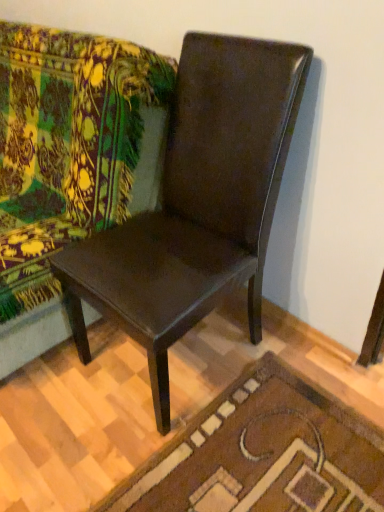
Where is `glossy brown chair at center`? This screenshot has width=384, height=512. glossy brown chair at center is located at coordinates (196, 204).

Where is `green floral fabric couch at upper left`? Image resolution: width=384 pixels, height=512 pixels. green floral fabric couch at upper left is located at coordinates (69, 162).

Is green floral fabric couch at upper left at the right side of brown textured rug at lower center?

No, green floral fabric couch at upper left is not to the right of brown textured rug at lower center.

Does green floral fabric couch at upper left touch brown textured rug at lower center?

No, green floral fabric couch at upper left is not beside brown textured rug at lower center.

From the image's perspective, is green floral fabric couch at upper left located above brown textured rug at lower center?

Correct, green floral fabric couch at upper left appears higher than brown textured rug at lower center in the image.

At what (x,y) coordinates should I click in order to perform the action: click on studio couch on the left of brown textured rug at lower center. Please return your answer as a coordinate pair (x, y). The width and height of the screenshot is (384, 512). Looking at the image, I should click on (69, 162).

Is brown textured rug at lower center in front of or behind green floral fabric couch at upper left in the image?

brown textured rug at lower center is positioned farther from the viewer than green floral fabric couch at upper left.

Is brown textured rug at lower center to the left or to the right of green floral fabric couch at upper left in the image?

Based on their positions, brown textured rug at lower center is located to the right of green floral fabric couch at upper left.

Between brown textured rug at lower center and green floral fabric couch at upper left, which one has larger size?

With larger size is green floral fabric couch at upper left.

How far apart are glossy brown chair at center and brown textured rug at lower center?

19.22 inches.

Is glossy brown chair at center directly adjacent to brown textured rug at lower center?

glossy brown chair at center and brown textured rug at lower center are clearly separated.

Is point (116, 259) more distant than point (181, 507)?

Yes, point (116, 259) is farther from viewer.

In the scene shown: Considering the sizes of glossy brown chair at center and brown textured rug at lower center in the image, is glossy brown chair at center wider or thinner than brown textured rug at lower center?

Clearly, glossy brown chair at center has less width compared to brown textured rug at lower center.

Which point is more forward, (54, 64) or (287, 131)?

The point (287, 131) is closer.

From the image's perspective, which object appears higher, green floral fabric couch at upper left or glossy brown chair at center?

green floral fabric couch at upper left, from the image's perspective.

Is the position of green floral fabric couch at upper left more distant than that of glossy brown chair at center?

Yes, green floral fabric couch at upper left is further from the viewer.

Can you tell me how much green floral fabric couch at upper left and glossy brown chair at center differ in facing direction?

green floral fabric couch at upper left and glossy brown chair at center are facing 3.18 degrees away from each other.

Can you confirm if glossy brown chair at center is taller than green floral fabric couch at upper left?

Correct, glossy brown chair at center is much taller as green floral fabric couch at upper left.

From the image's perspective, is glossy brown chair at center over green floral fabric couch at upper left?

No, from the image's perspective, glossy brown chair at center is not on top of green floral fabric couch at upper left.

Locate an element on the screen. The width and height of the screenshot is (384, 512). chair lying below the green floral fabric couch at upper left (from the image's perspective) is located at coordinates (196, 204).

Does glossy brown chair at center turn towards green floral fabric couch at upper left?

No, glossy brown chair at center does not turn towards green floral fabric couch at upper left.

Which is in front, brown textured rug at lower center or glossy brown chair at center?

glossy brown chair at center is closer to the camera.

From a real-world perspective, is brown textured rug at lower center beneath glossy brown chair at center?

Yes.

Measure the distance between brown textured rug at lower center and glossy brown chair at center.

19.22 inches.

From the image's perspective, does brown textured rug at lower center appear lower than glossy brown chair at center?

Correct, brown textured rug at lower center appears lower than glossy brown chair at center in the image.

Find the location of `studio couch above the brown textured rug at lower center (from a real-world perspective)`. studio couch above the brown textured rug at lower center (from a real-world perspective) is located at coordinates (69, 162).

The width and height of the screenshot is (384, 512). In order to click on doormat lying behind the green floral fabric couch at upper left in this screenshot , I will do `click(263, 454)`.

Estimate the real-world distances between objects in this image. Which object is further from green floral fabric couch at upper left, glossy brown chair at center or brown textured rug at lower center?

brown textured rug at lower center is positioned further to the anchor green floral fabric couch at upper left.

Based on their spatial positions, is green floral fabric couch at upper left or glossy brown chair at center further from brown textured rug at lower center?

Among the two, green floral fabric couch at upper left is located further to brown textured rug at lower center.

Looking at the image, which one is located closer to green floral fabric couch at upper left, brown textured rug at lower center or glossy brown chair at center?

Based on the image, glossy brown chair at center appears to be nearer to green floral fabric couch at upper left.

From the image, which object appears to be nearer to glossy brown chair at center, green floral fabric couch at upper left or brown textured rug at lower center?

Based on the image, green floral fabric couch at upper left appears to be nearer to glossy brown chair at center.

Based on their spatial positions, is glossy brown chair at center or green floral fabric couch at upper left closer to brown textured rug at lower center?

glossy brown chair at center lies closer to brown textured rug at lower center than the other object.

From the picture: Estimate the real-world distances between objects in this image. Which object is closer to glossy brown chair at center, brown textured rug at lower center or green floral fabric couch at upper left?

green floral fabric couch at upper left lies closer to glossy brown chair at center than the other object.

The height and width of the screenshot is (512, 384). Find the location of `chair situated between green floral fabric couch at upper left and brown textured rug at lower center from left to right`. chair situated between green floral fabric couch at upper left and brown textured rug at lower center from left to right is located at coordinates (196, 204).